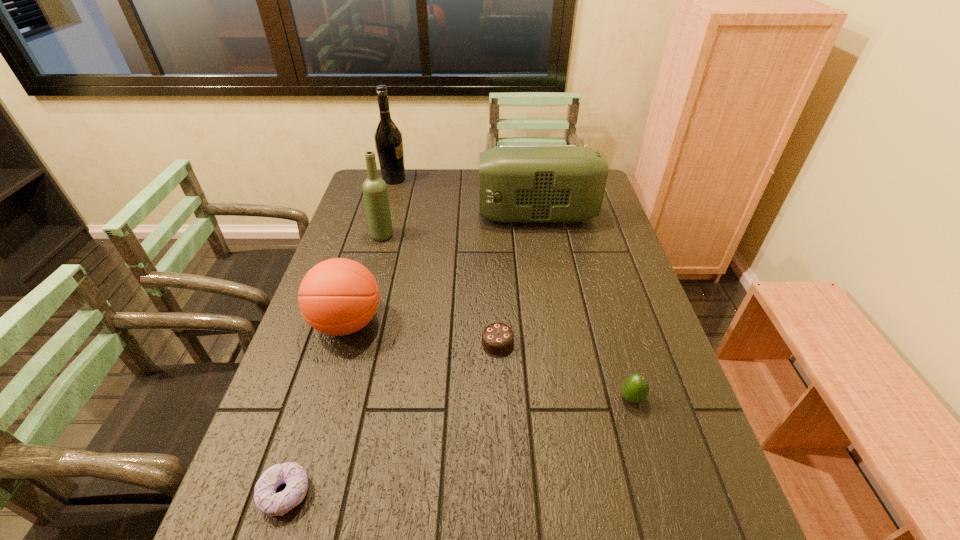
Identify the location of object that is the sixth closest to the taller wine bottle. (266, 499).

This screenshot has width=960, height=540. In order to click on free space that satisfies the following two spatial constraints: 1. on the label of the chocolate cake; 2. on the right side of the farthest object in this screenshot , I will do `click(348, 342)`.

Where is `vacant point that satisfies the following two spatial constraints: 1. on the label of the farther wine bottle; 2. on the back side of the second nearest object`? vacant point that satisfies the following two spatial constraints: 1. on the label of the farther wine bottle; 2. on the back side of the second nearest object is located at coordinates (332, 398).

You are a GUI agent. You are given a task and a screenshot of the screen. Output one action in this format:
    pyautogui.click(x=<x>, y=<y>)
    Task: Click on the vacant position in the image that satisfies the following two spatial constraints: 1. on the front-facing side of the fifth shortest object; 2. on the front side of the chocolate cake
    
    Given the screenshot: What is the action you would take?
    pyautogui.click(x=559, y=342)